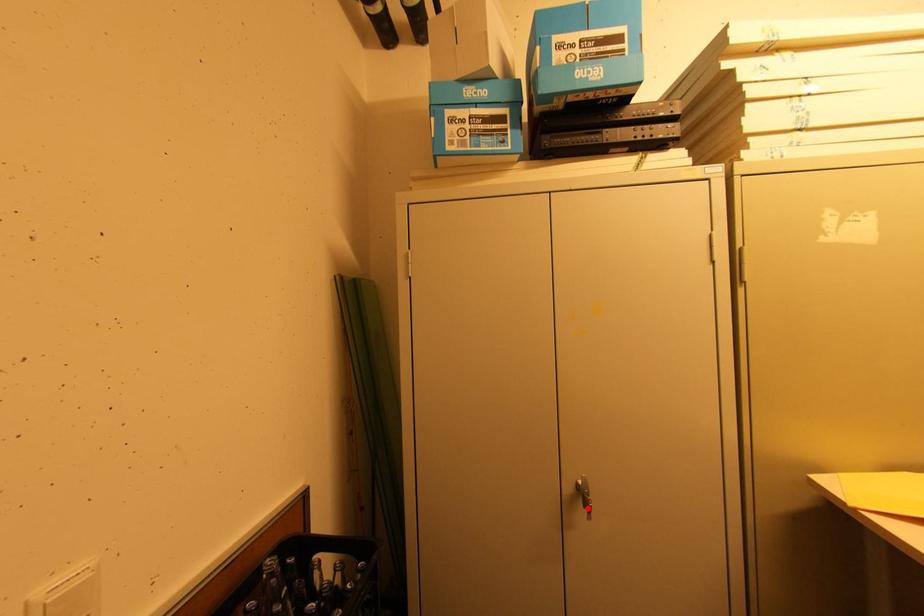
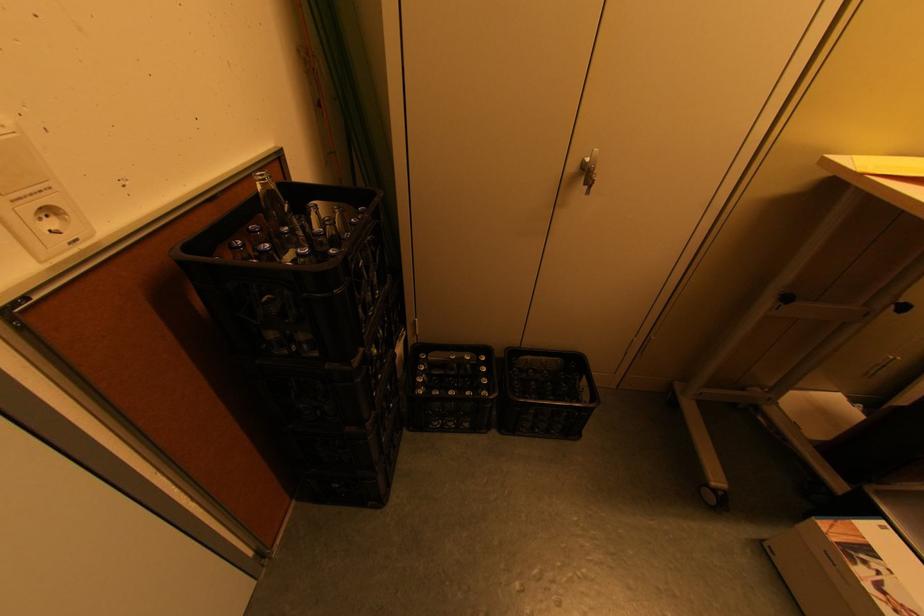
The point at the highlighted location is marked in the first image. Where is the corresponding point in the second image?

(588, 185)